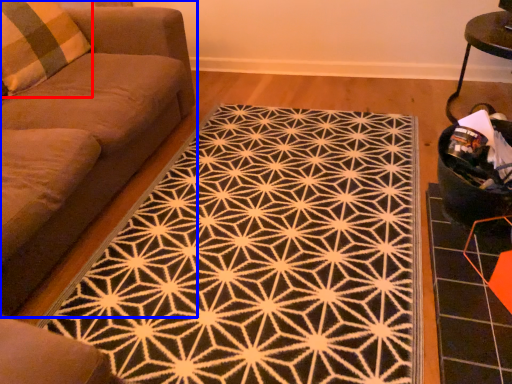
Question: Which point is further to the camera, pillow (highlighted by a red box) or studio couch (highlighted by a blue box)?

Choices:
 (A) pillow
 (B) studio couch

Answer: (A)